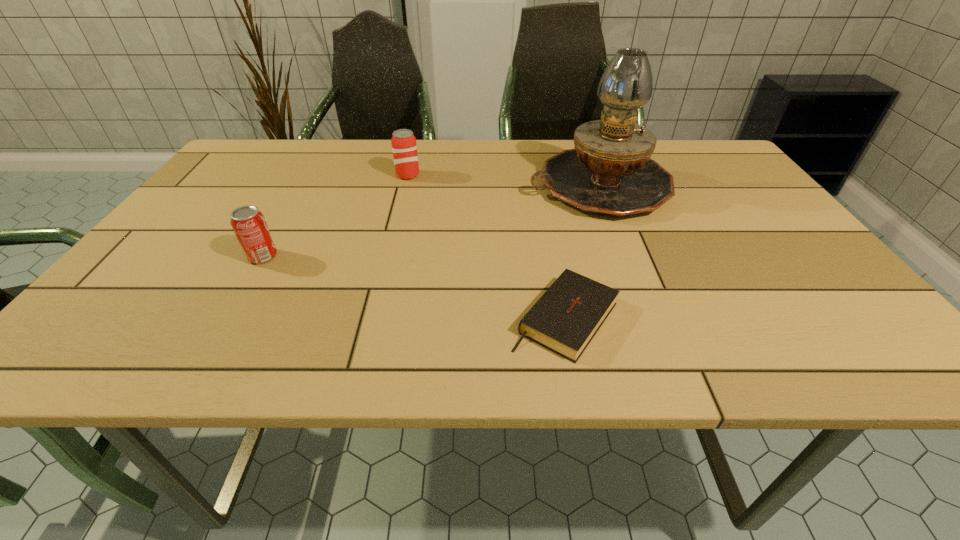
Where is `oil lamp`? The width and height of the screenshot is (960, 540). oil lamp is located at coordinates (609, 172).

You are a GUI agent. You are given a task and a screenshot of the screen. Output one action in this format:
    pyautogui.click(x=<x>, y=<y>)
    Task: Click on the beer can
    The image size is (960, 540).
    Given the screenshot: What is the action you would take?
    pyautogui.click(x=404, y=147)

The width and height of the screenshot is (960, 540). What are the coordinates of `the third farthest object` in the screenshot? It's located at (249, 225).

At what (x,y) coordinates should I click in order to perform the action: click on the leftmost object. Please return your answer as a coordinate pair (x, y). This screenshot has height=540, width=960. Looking at the image, I should click on (249, 225).

What are the coordinates of `the shortest object` in the screenshot? It's located at click(565, 319).

At what (x,y) coordinates should I click in order to perform the action: click on the nearest object. Please return your answer as a coordinate pair (x, y). This screenshot has height=540, width=960. Looking at the image, I should click on click(x=565, y=319).

You are a GUI agent. You are given a task and a screenshot of the screen. Output one action in this format:
    pyautogui.click(x=<x>, y=<y>)
    Task: Click on the free point located 0.140m on the left of the oil lamp
    This screenshot has width=960, height=540.
    Given the screenshot: What is the action you would take?
    pyautogui.click(x=475, y=186)

Image resolution: width=960 pixels, height=540 pixels. In order to click on vacant region located on the front of the beer can in this screenshot , I will do `click(382, 280)`.

Image resolution: width=960 pixels, height=540 pixels. I want to click on vacant area situated on the right of the soda can, so click(451, 256).

You are a GUI agent. You are given a task and a screenshot of the screen. Output one action in this format:
    pyautogui.click(x=<x>, y=<y>)
    Task: Click on the vacant space located 0.050m on the right of the shortest object
    The height and width of the screenshot is (540, 960).
    Given the screenshot: What is the action you would take?
    pyautogui.click(x=647, y=319)